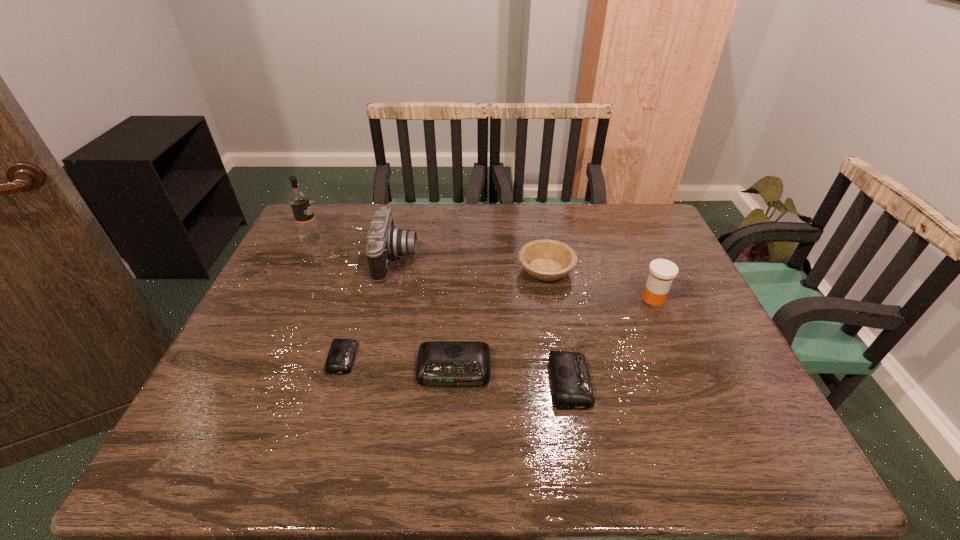
Find the location of a particular element. The height and width of the screenshot is (540, 960). the rightmost object is located at coordinates click(662, 272).

Where is `vacant space located on the display of the leftmost alarm clock`? This screenshot has height=540, width=960. vacant space located on the display of the leftmost alarm clock is located at coordinates (426, 358).

Where is `free point located 0.050m on the display of the second alarm clock from right to left`? Image resolution: width=960 pixels, height=540 pixels. free point located 0.050m on the display of the second alarm clock from right to left is located at coordinates (452, 408).

The image size is (960, 540). What are the coordinates of `free space located 0.300m on the display of the second shortest alarm clock` in the screenshot? It's located at (721, 382).

At what (x,y) coordinates should I click in order to perform the action: click on free space located on the back of the fourth shortest object. Please return your answer as a coordinate pair (x, y). The width and height of the screenshot is (960, 540). Looking at the image, I should click on (535, 208).

Where is `vacant region located on the front-facing side of the camera`? The height and width of the screenshot is (540, 960). vacant region located on the front-facing side of the camera is located at coordinates (516, 259).

Identify the location of free region located on the label of the tallest object. (433, 239).

This screenshot has height=540, width=960. In order to click on free region located on the label of the third tallest object in this screenshot , I will do `click(517, 299)`.

I want to click on free space located 0.100m on the label of the third tallest object, so click(604, 299).

The image size is (960, 540). Find the location of `vacant space located 0.300m on the label of the third tallest object`. vacant space located 0.300m on the label of the third tallest object is located at coordinates click(x=532, y=299).